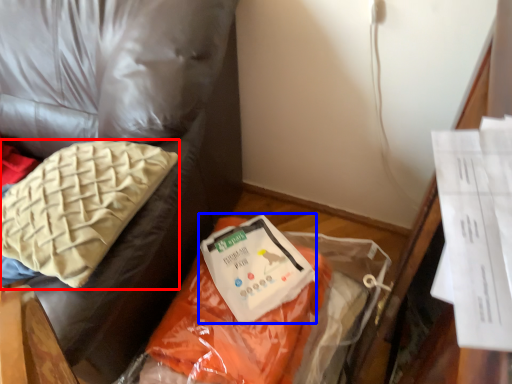
Question: Which of the following is the farthest to the observer, pillow (highlighted by a red box) or wrap (highlighted by a blue box)?

Choices:
 (A) pillow
 (B) wrap

Answer: (B)